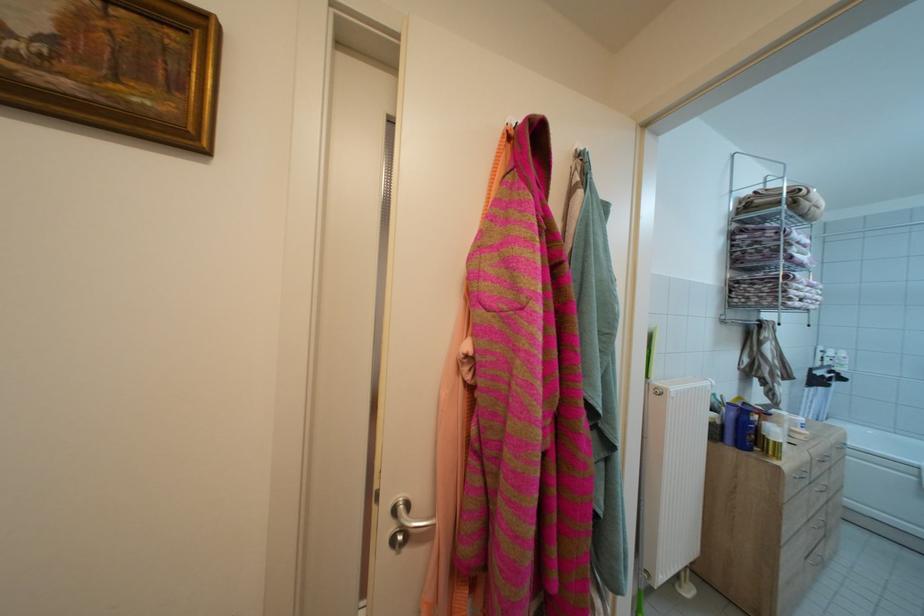
This screenshot has height=616, width=924. Describe the element at coordinates (654, 390) in the screenshot. I see `the white radiator knob` at that location.